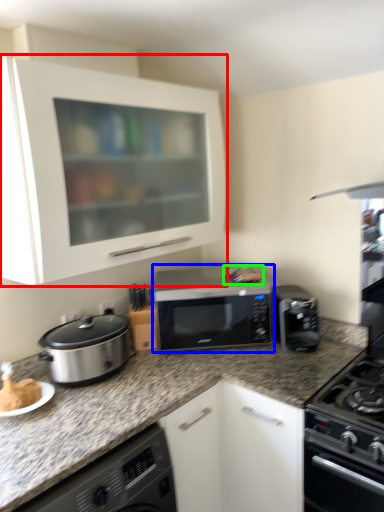
Question: Which object is the farthest from cabinetry (highlighted by a red box)? Choose among these: microwave oven (highlighted by a blue box) or food (highlighted by a green box).

Choices:
 (A) microwave oven
 (B) food

Answer: (B)